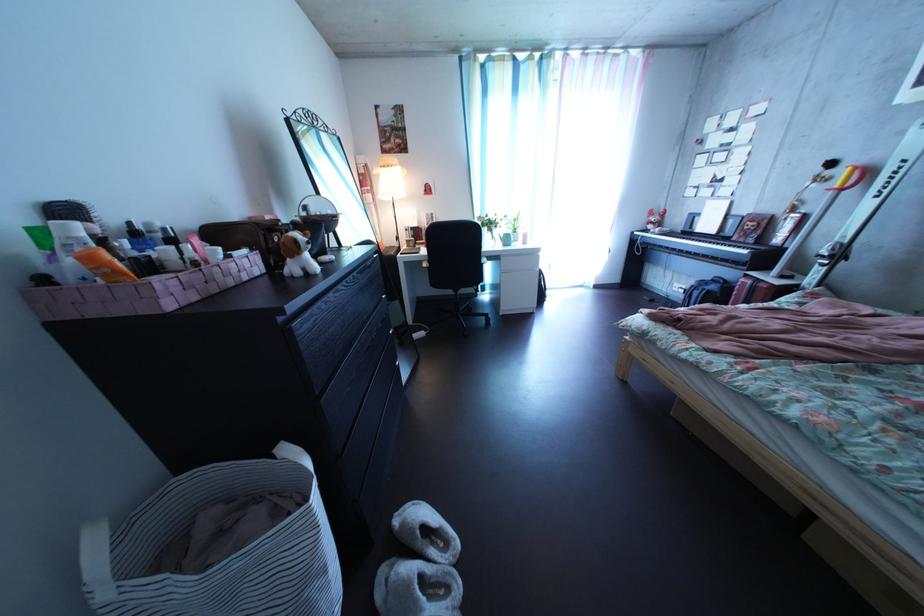
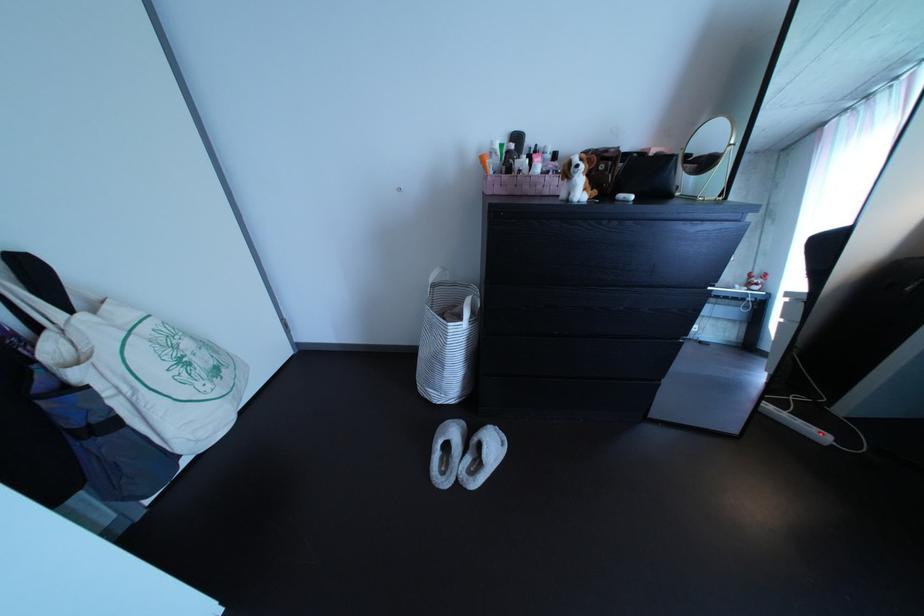
The images are taken continuously from a first-person perspective. In which direction is your viewpoint rotating?

The rotation direction of the camera is left-down.